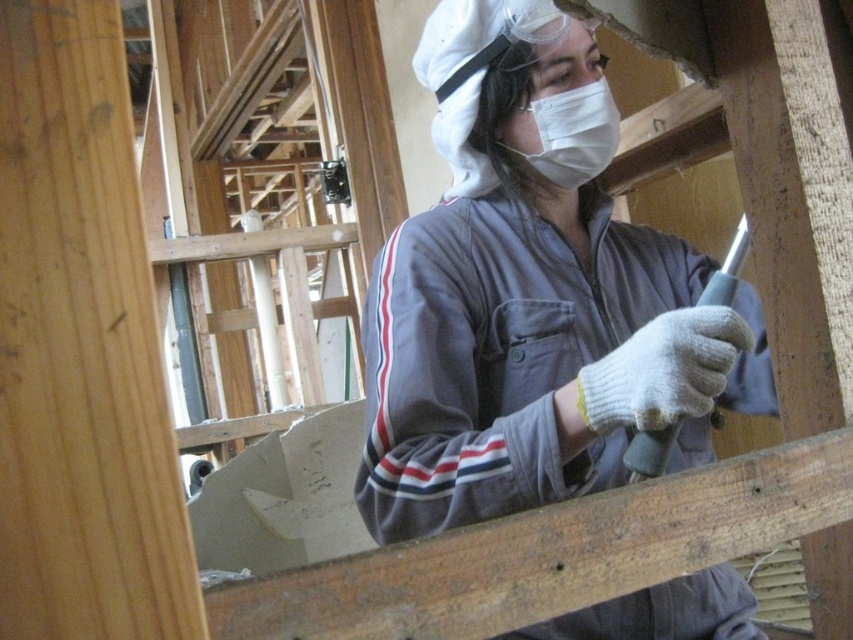
You are a safety inspector examining the worker in the image. The gray fabric at center is part of their clothing, and the white fabric mask at center is part of their PPE. Based on safety standards, which item should be positioned higher on the worker to ensure proper protection?

The white fabric mask at center should be positioned higher than the gray fabric at center to ensure proper protection, as masks are typically worn over the mouth and nose area, which is higher on the face compared to other clothing items.

You are a safety inspector observing a worker in a construction site. You notice the worker is wearing a gray fabric at center and a white fabric mask at center. According to safety protocols, which fabric should be adjusted to ensure proper mask fitment?

The gray fabric at center should be adjusted because it is positioned on the right side of the white fabric mask at center, which might interfere with the mask fitment.